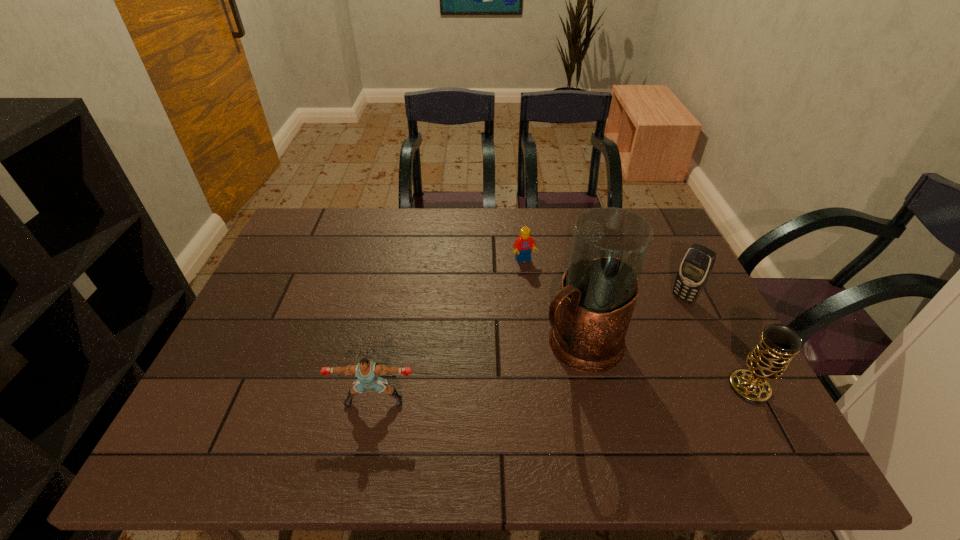
Where is `the second shortest object`? the second shortest object is located at coordinates (366, 371).

Identify the location of the leftmost object. (366, 371).

At what (x,y) coordinates should I click in order to perform the action: click on chalice. Please return your answer as a coordinate pair (x, y). Looking at the image, I should click on (768, 360).

At what (x,y) coordinates should I click in order to perform the action: click on the shortest object. Please return your answer as a coordinate pair (x, y). This screenshot has height=540, width=960. Looking at the image, I should click on (523, 245).

Find the location of `the farthest object`. the farthest object is located at coordinates (523, 245).

Find the location of a particular element. The height and width of the screenshot is (540, 960). the fourth nearest object is located at coordinates (697, 264).

The height and width of the screenshot is (540, 960). What are the coordinates of `pitcher` in the screenshot? It's located at (590, 315).

Locate an element on the screen. blank area located 0.230m on the left of the chalice is located at coordinates (631, 387).

The image size is (960, 540). Find the location of `blank space located 0.330m on the face of the farthest object`. blank space located 0.330m on the face of the farthest object is located at coordinates (567, 350).

You are a GUI agent. You are given a task and a screenshot of the screen. Output one action in this format:
    pyautogui.click(x=<x>, y=<y>)
    Task: Click on the free space located 0.150m on the face of the farthest object
    
    Given the screenshot: What is the action you would take?
    pyautogui.click(x=543, y=300)